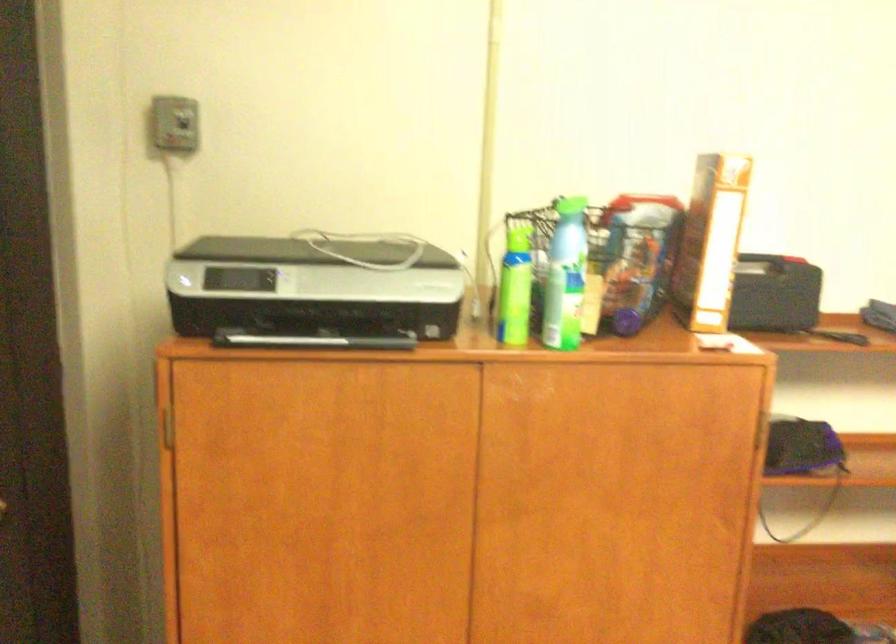
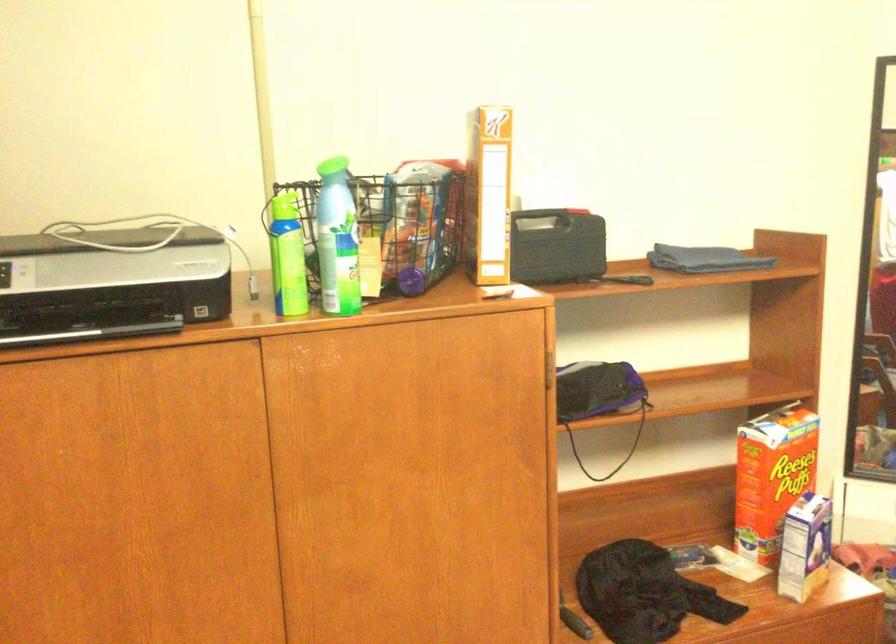
Question: Which direction would the cameraman need to move to produce the second image? Reply with the corresponding letter.

Choices:
 (A) Left
 (B) Right
 (C) Forward
 (D) Backward

Answer: (B)